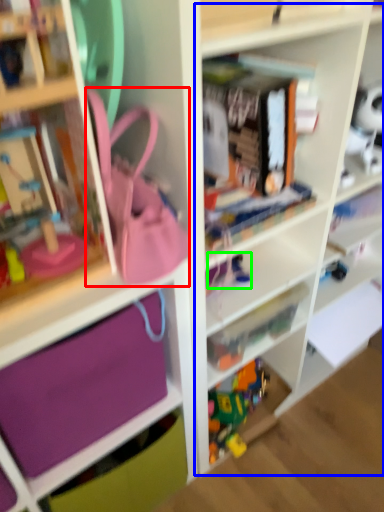
Question: Which object is positioned farthest from accessory (highlighted by a red box)? Select from cabinet (highlighted by a blue box) and toy (highlighted by a green box).

Choices:
 (A) cabinet
 (B) toy

Answer: (A)